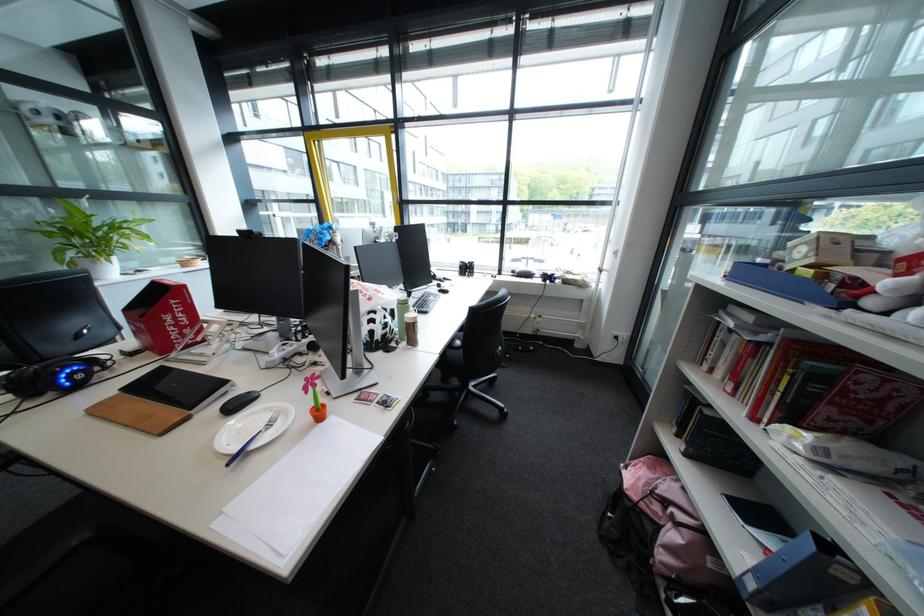
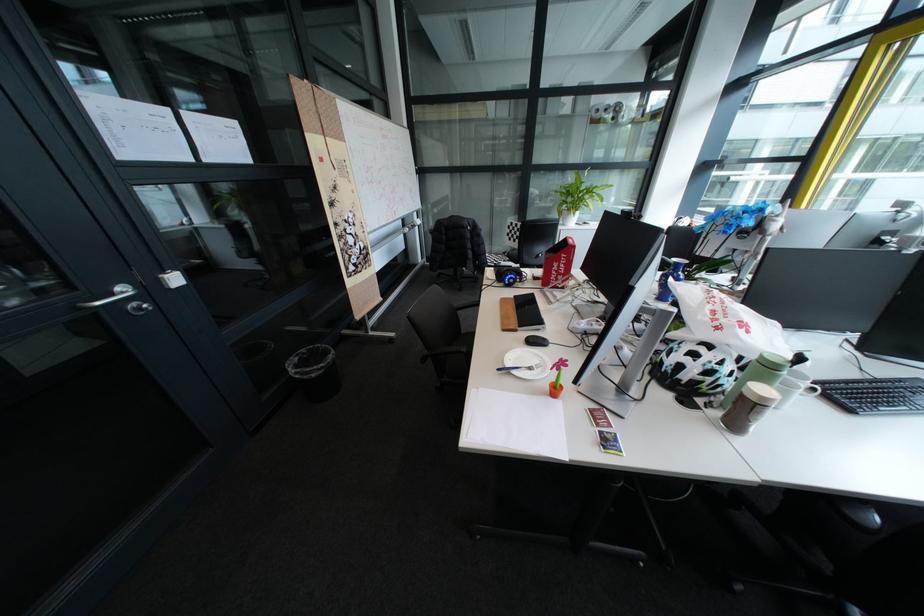
The point at (242, 464) is marked in the first image. Where is the corresponding point in the second image?

(513, 370)